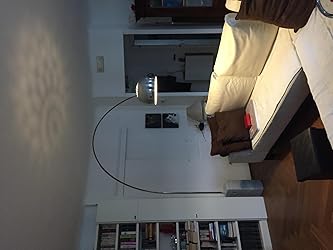
Locate an element on the screen. This screenshot has width=333, height=250. ceiling is located at coordinates (36, 180).